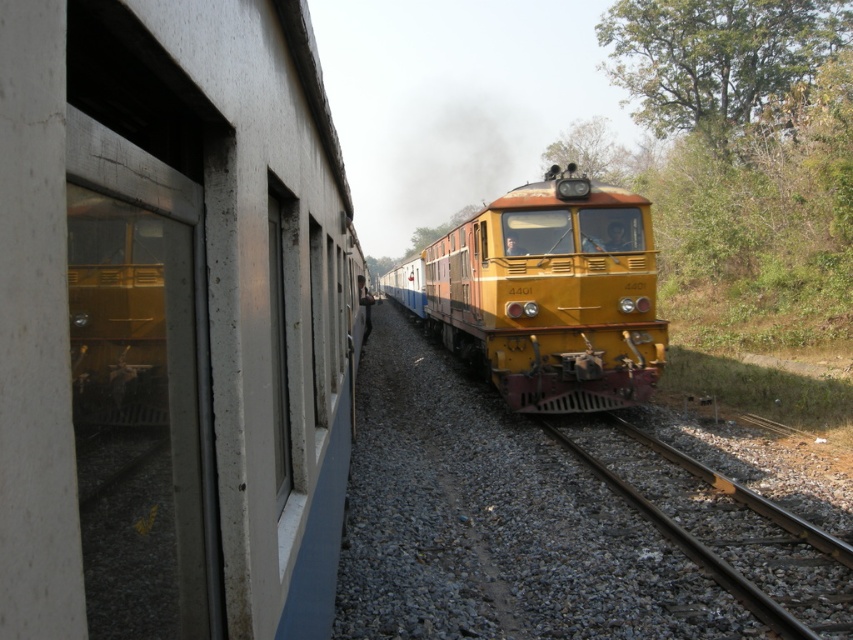
Question: Is yellow metallic train at center wider than smooth metal train track at center?

Choices:
 (A) no
 (B) yes

Answer: (B)

Question: In this image, where is yellow metallic train at center located relative to green leafy tree at upper right?

Choices:
 (A) left
 (B) right

Answer: (A)

Question: Which point is closer to the camera?

Choices:
 (A) [x=642, y=0]
 (B) [x=709, y=556]

Answer: (B)

Question: Is yellow metallic train at center to the right of smooth metal train track at center from the viewer's perspective?

Choices:
 (A) yes
 (B) no

Answer: (B)

Question: Which object is closer to the camera taking this photo?

Choices:
 (A) smooth metal train track at center
 (B) yellow metallic train at center
 (C) green leafy tree at upper right
 (D) green leafy tree at upper center

Answer: (A)

Question: Among these objects, which one is nearest to the camera?

Choices:
 (A) yellow metallic train at center
 (B) green leafy tree at upper center
 (C) smooth metal train track at center

Answer: (C)